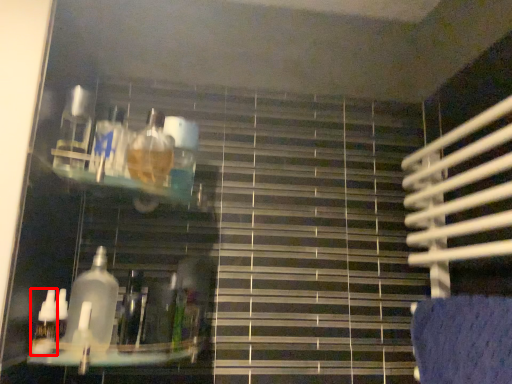
Question: From the image's perspective, what is the correct spatial positioning of bottle (annotated by the red box) in reference to bottle?

Choices:
 (A) above
 (B) below

Answer: (B)